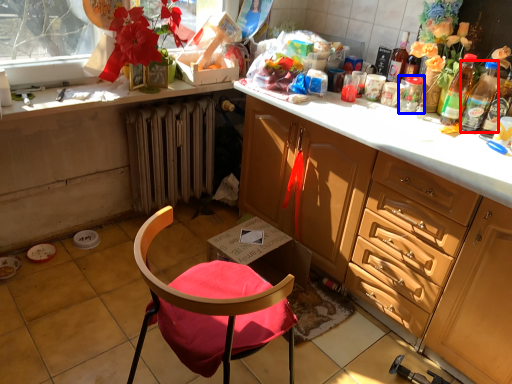
Question: Which object is closer to the camera taking this photo, bottle (highlighted by a red box) or glass jar (highlighted by a blue box)?

Choices:
 (A) bottle
 (B) glass jar

Answer: (A)